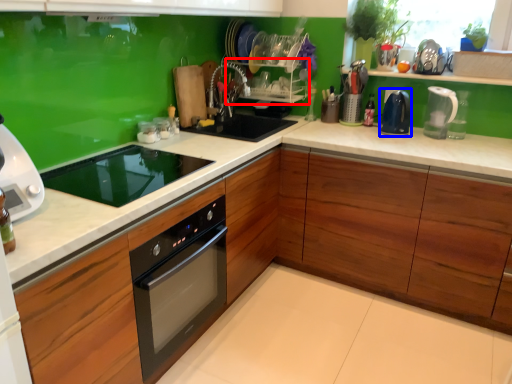
Question: Which point is further to the camera, shelf (highlighted by a red box) or kitchen appliance (highlighted by a blue box)?

Choices:
 (A) shelf
 (B) kitchen appliance

Answer: (A)